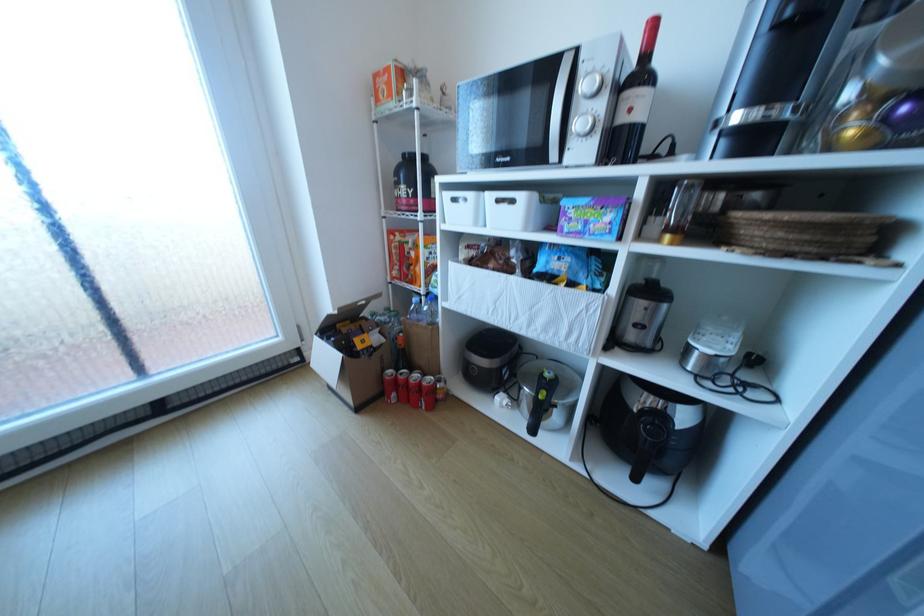
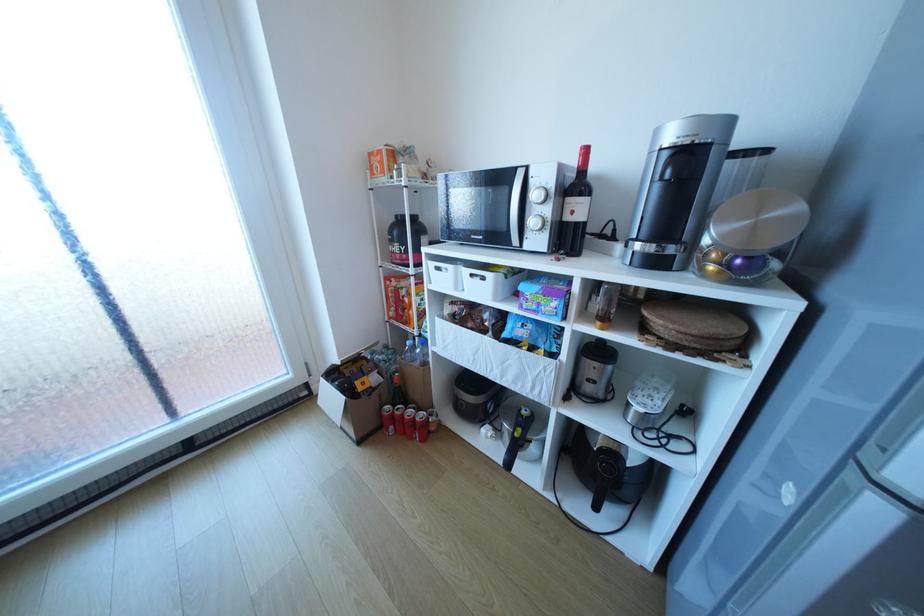
Where in the second image is the point corresponding to point (530, 400) from the first image?

(513, 434)